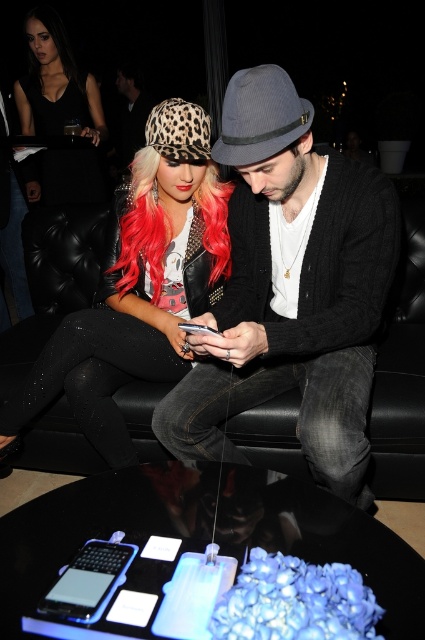
Consider the image. You are at a party and want to take a photo of the two people on the black leather couch. To ensure both the leopard print hat at center and the leather jacket at center are visible in the frame, which side should you position yourself relative to the couch?

You should position yourself to the left of the couch so that both the leopard print hat at center and the leather jacket at center are visible in the frame. Since the leopard print hat at center is to the right of the leather jacket at center, positioning yourself to the left ensures you can capture both objects in the frame without one being obscured.

You are standing in the room where the two people are sitting on the black leather couch. You need to place a small table between the two points marked as point (198, 307) and point (132, 67). Which point should the table be closer to in order to be positioned in front of both people?

The table should be closer to point (132, 67) because point (198, 307) is in front of point (132, 67). Placing the table near the rear point ensures it is accessible to both individuals.

You are a photographer at a social event and need to capture a closeup shot of both the matte gray fedora at center and the leopard print hat at center in the same frame. The camera you are using has a minimum focus distance of 30 centimeters. Will you be able to focus on both hats simultaneously?

The matte gray fedora at center and leopard print hat at center are 29.20 centimeters apart from each other. Since the camera requires a minimum focus distance of 30 centimeters, the photographer cannot focus on both hats simultaneously because the distance between them is less than the required minimum focus distance.